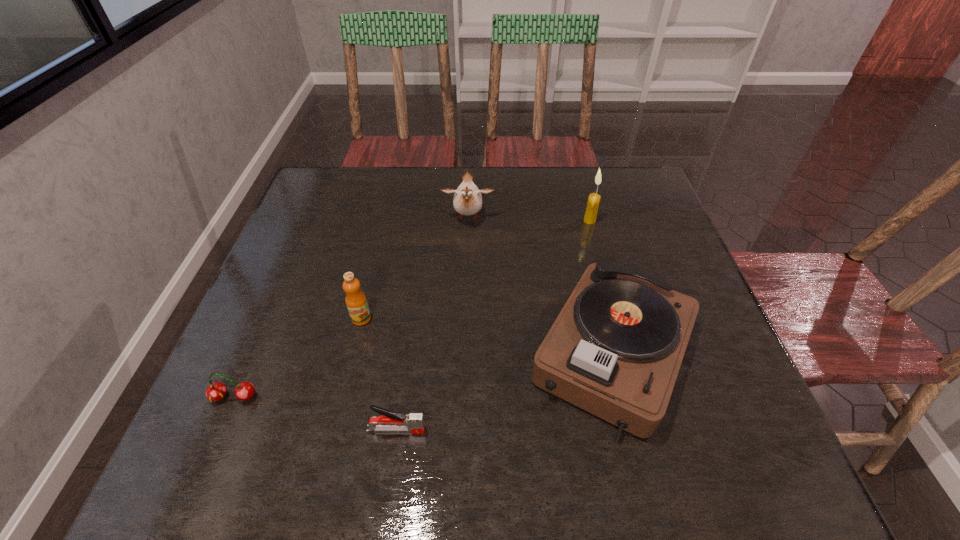
This screenshot has height=540, width=960. I want to click on vacant space situated 0.330m on the handle side of the stapler, so click(x=609, y=430).

Locate an element on the screen. The width and height of the screenshot is (960, 540). vacant space located 0.060m with stems pointing upwards on the cherry is located at coordinates (217, 437).

You are a GUI agent. You are given a task and a screenshot of the screen. Output one action in this format:
    pyautogui.click(x=<x>, y=<y>)
    Task: Click on the object at the far edge
    The width and height of the screenshot is (960, 540).
    Given the screenshot: What is the action you would take?
    pyautogui.click(x=467, y=200)

At what (x,y) coordinates should I click in order to perform the action: click on record player that is at the near edge. Please return your answer as a coordinate pair (x, y). The width and height of the screenshot is (960, 540). Looking at the image, I should click on (x=615, y=349).

I want to click on stapler located in the near edge section of the desktop, so click(390, 421).

Find the location of `object that is at the left edge`. object that is at the left edge is located at coordinates (216, 391).

Locate an element on the screen. The width and height of the screenshot is (960, 540). object present at the right edge is located at coordinates (615, 349).

Where is `object that is at the near right corner`? The image size is (960, 540). object that is at the near right corner is located at coordinates (615, 349).

Locate an element on the screen. vacant region at the far edge of the desktop is located at coordinates (516, 180).

This screenshot has width=960, height=540. Find the location of `free region at the near edge of the desktop`. free region at the near edge of the desktop is located at coordinates 641,444.